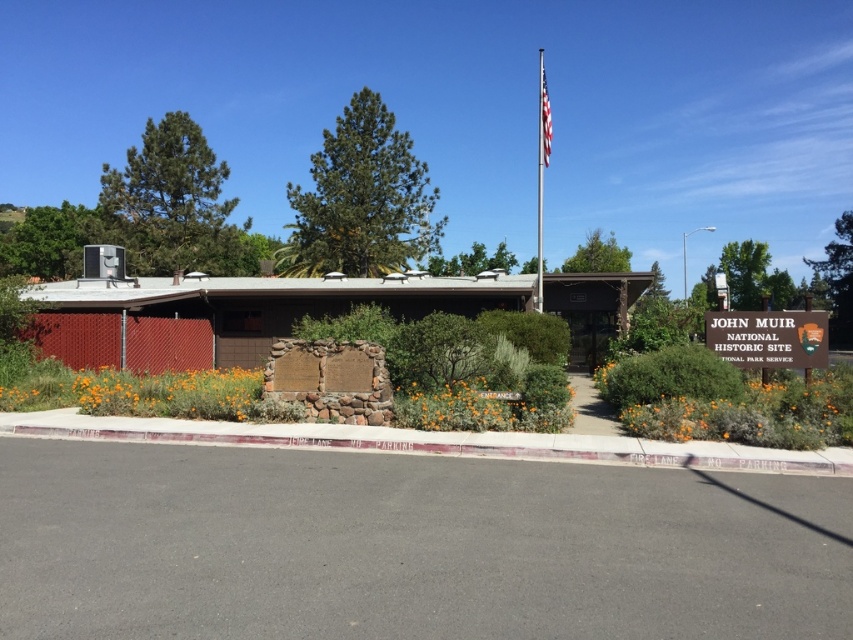
Question: Which point is closer to the camera?

Choices:
 (A) green wooden sign at center
 (B) american flag at upper center
 (C) polished metal flag pole at upper center

Answer: (A)

Question: Which object is closer to the camera taking this photo?

Choices:
 (A) green wooden sign at center
 (B) polished metal flag pole at upper center
 (C) american flag at upper center

Answer: (A)

Question: Does green wooden sign at center appear under american flag at upper center?

Choices:
 (A) yes
 (B) no

Answer: (A)

Question: Is polished metal flag pole at upper center thinner than american flag at upper center?

Choices:
 (A) yes
 (B) no

Answer: (B)

Question: Which object is closer to the camera taking this photo?

Choices:
 (A) green wooden sign at center
 (B) polished metal flag pole at upper center

Answer: (A)

Question: Does polished metal flag pole at upper center appear under american flag at upper center?

Choices:
 (A) no
 (B) yes

Answer: (B)